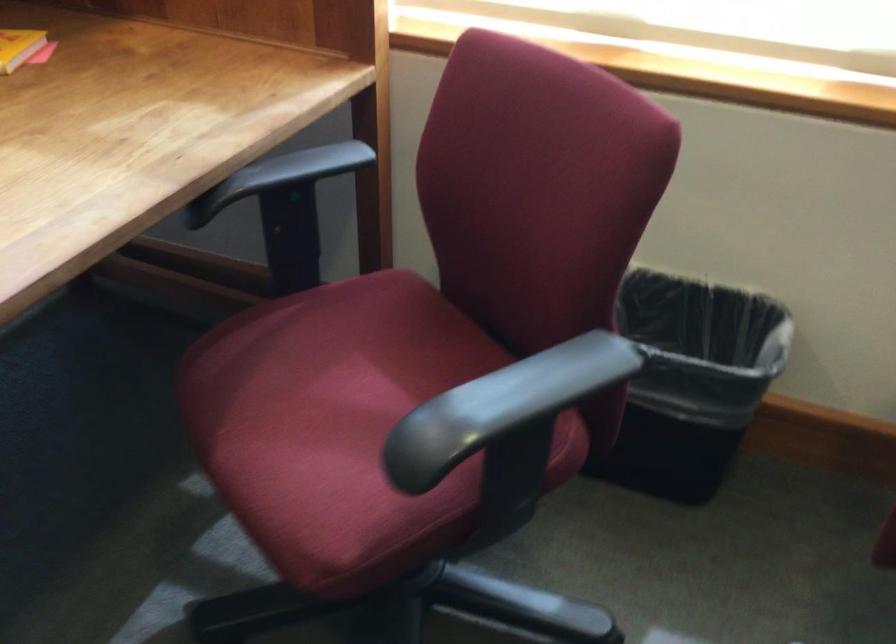
The images are taken continuously from a first-person perspective. In which direction is your viewpoint rotating?

The camera's rotation is toward right-down.